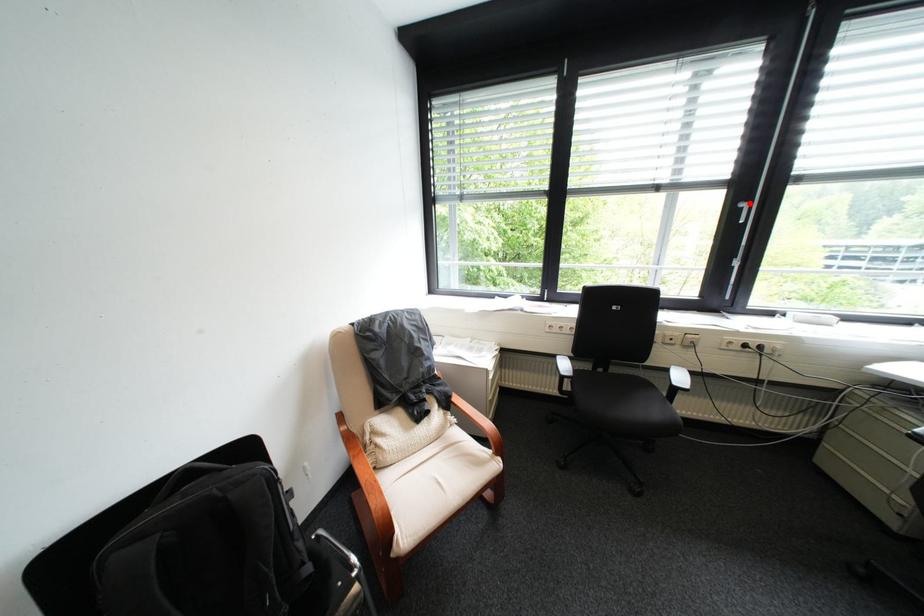
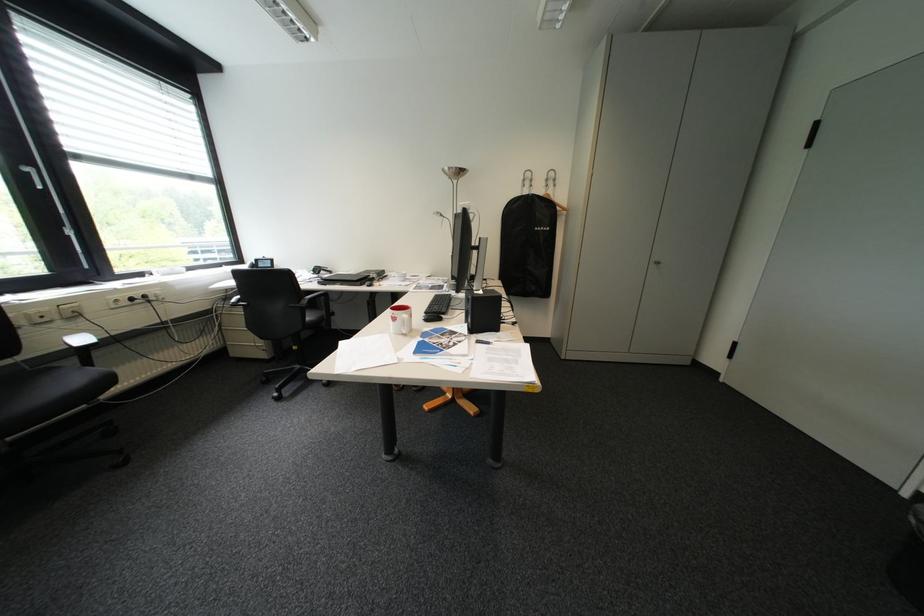
Question: I am providing you with two images of the same scene from different viewpoints. In image1, a red point is highlighted. Considering the same 3D point in image2, which of the following is correct?

Choices:
 (A) It is closer
 (B) It is farther

Answer: (B)